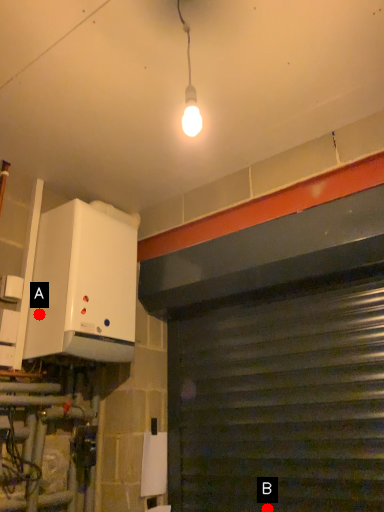
Question: Two points are circled on the image, labeled by A and B beside each circle. Which point is farther to the camera?

Choices:
 (A) A is further
 (B) B is further

Answer: (A)